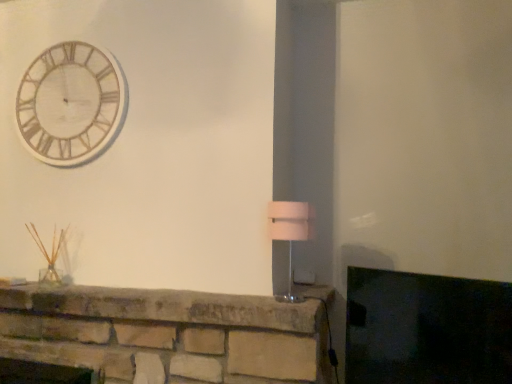
Question: Looking at the image, does matte stone fireplace at lower left seem bigger or smaller compared to white fabric lampshade at right?

Choices:
 (A) small
 (B) big

Answer: (B)

Question: From a real-world perspective, relative to white fabric lampshade at right, is matte stone fireplace at lower left vertically above or below?

Choices:
 (A) below
 (B) above

Answer: (A)

Question: Which of these objects is positioned farthest from the wooden/textured clock at upper left?

Choices:
 (A) white fabric lampshade at right
 (B) matte stone fireplace at lower left

Answer: (B)

Question: Based on their relative distances, which object is nearer to the wooden/textured clock at upper left?

Choices:
 (A) matte stone fireplace at lower left
 (B) white fabric lampshade at right

Answer: (B)